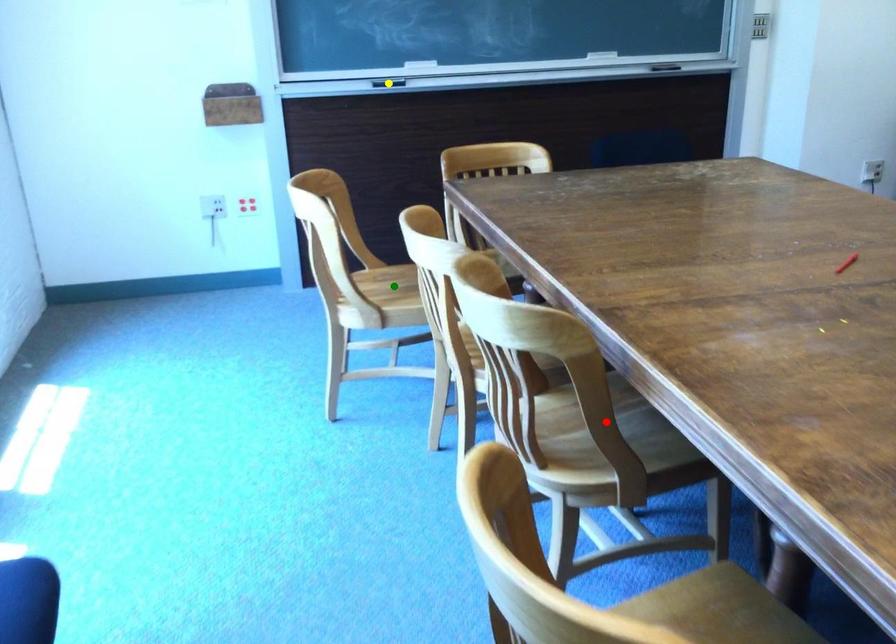
Order these from nearest to farthest:
red point | green point | yellow point

red point
green point
yellow point